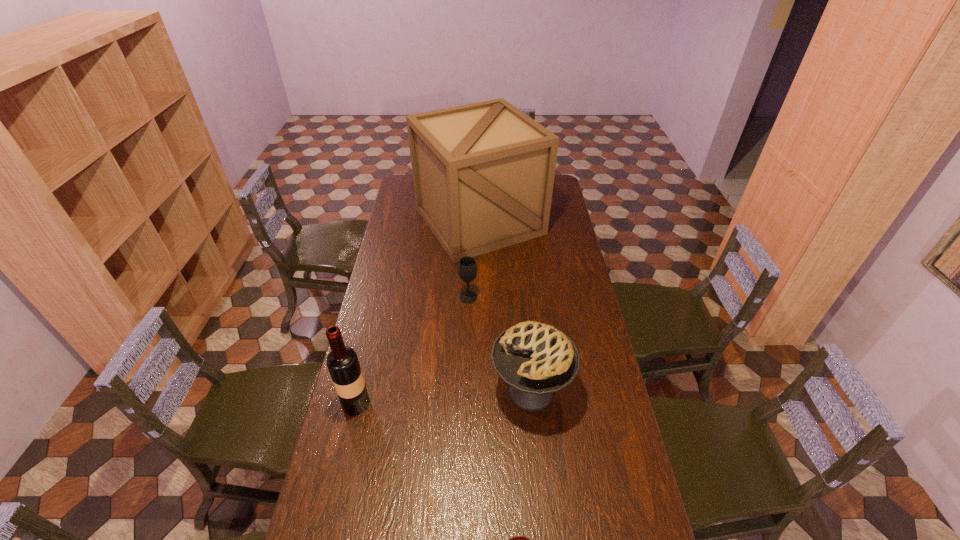
Identify the location of the farthest object. The image size is (960, 540). (483, 173).

At what (x,y) coordinates should I click in order to perform the action: click on the tallest object. Please return your answer as a coordinate pair (x, y). Looking at the image, I should click on (483, 173).

This screenshot has height=540, width=960. I want to click on the leftmost object, so click(342, 362).

Image resolution: width=960 pixels, height=540 pixels. Find the location of `the fourth shortest object`. the fourth shortest object is located at coordinates (342, 362).

Where is `pie`? pie is located at coordinates (535, 360).

Identify the location of the fourth nearest object. The height and width of the screenshot is (540, 960). (467, 268).

Where is `wineglass`? wineglass is located at coordinates (467, 268).

You are a GUI agent. You are given a task and a screenshot of the screen. Output one action in this format:
    pyautogui.click(x=<x>, y=<y>)
    Task: Click on the vacant space located 0.090m on the right of the farthest object
    
    Given the screenshot: What is the action you would take?
    pyautogui.click(x=563, y=221)

Find the location of a particular element. The image size is (960, 540). vacant space positioned on the front of the second tallest object is located at coordinates (341, 469).

Locate an element on the screen. The image size is (960, 540). blank space located 0.170m on the cut side of the pie is located at coordinates (441, 391).